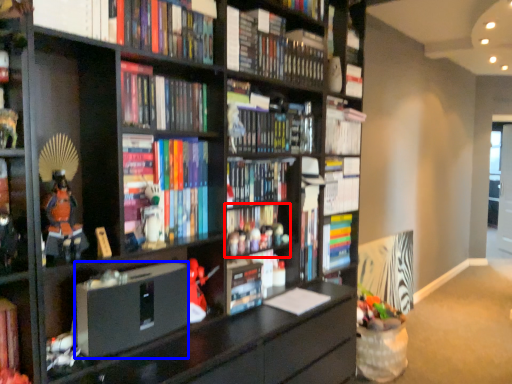
Question: Which point is closer to the camera, book (highlighted by a red box) or paperback book (highlighted by a blue box)?

Choices:
 (A) book
 (B) paperback book

Answer: (B)